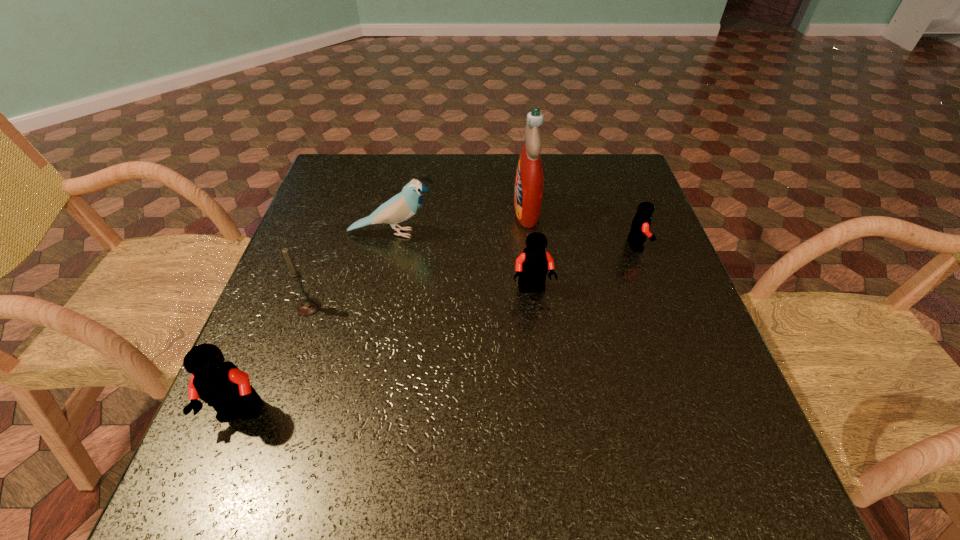
Locate an element on the screen. The width and height of the screenshot is (960, 540). vacant space located at the face of the bird is located at coordinates (477, 233).

Locate an element on the screen. The width and height of the screenshot is (960, 540). vacant space located 0.380m on the front surface of the tallest object is located at coordinates (370, 211).

Identify the location of free space located 0.210m on the front surface of the tallest object. (434, 211).

The image size is (960, 540). Identify the location of free spot located 0.150m on the front surface of the tallest object. coord(456,211).

You are a GUI agent. You are given a task and a screenshot of the screen. Output one action in this format:
    pyautogui.click(x=<x>, y=<y>)
    Task: Click on the free space located 0.230m on the front of the candle
    Image resolution: width=960 pixels, height=540 pixels.
    Given the screenshot: What is the action you would take?
    pyautogui.click(x=269, y=420)

Locate an element on the screen. The image size is (960, 540). object that is at the far edge is located at coordinates (528, 192).

Where is `object that is positioned at the near edge`? object that is positioned at the near edge is located at coordinates (219, 383).

The height and width of the screenshot is (540, 960). Identify the location of Lego present at the left edge. (219, 383).

Find the location of a particular element. This screenshot has height=540, width=960. bird that is at the left edge is located at coordinates (401, 207).

Where is `candle at the left edge`? The width and height of the screenshot is (960, 540). candle at the left edge is located at coordinates (307, 306).